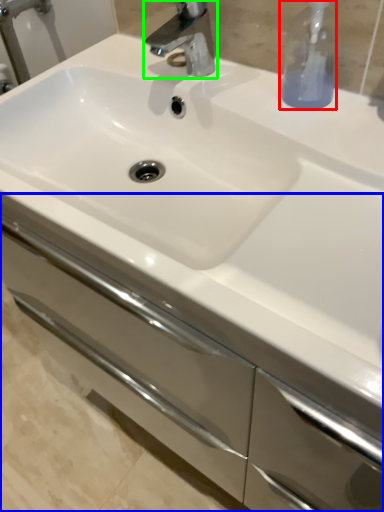
Question: Which object is the farthest from soap dispenser (highlighted by a red box)? Choose among these: bathroom cabinet (highlighted by a blue box) or tap (highlighted by a green box).

Choices:
 (A) bathroom cabinet
 (B) tap

Answer: (A)